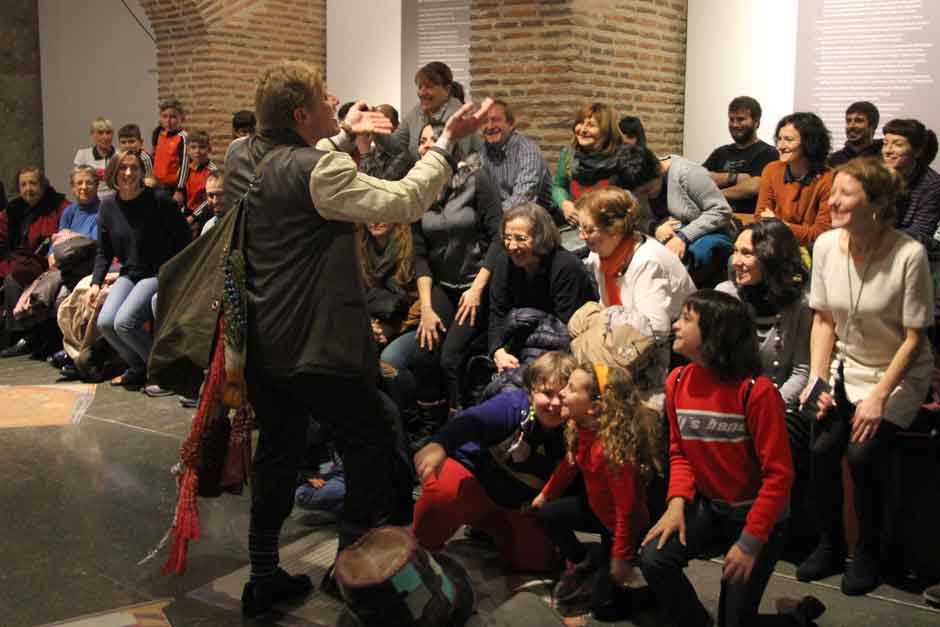
The image size is (940, 627). In order to click on placard in this screenshot , I will do `click(895, 46)`, `click(436, 36)`.